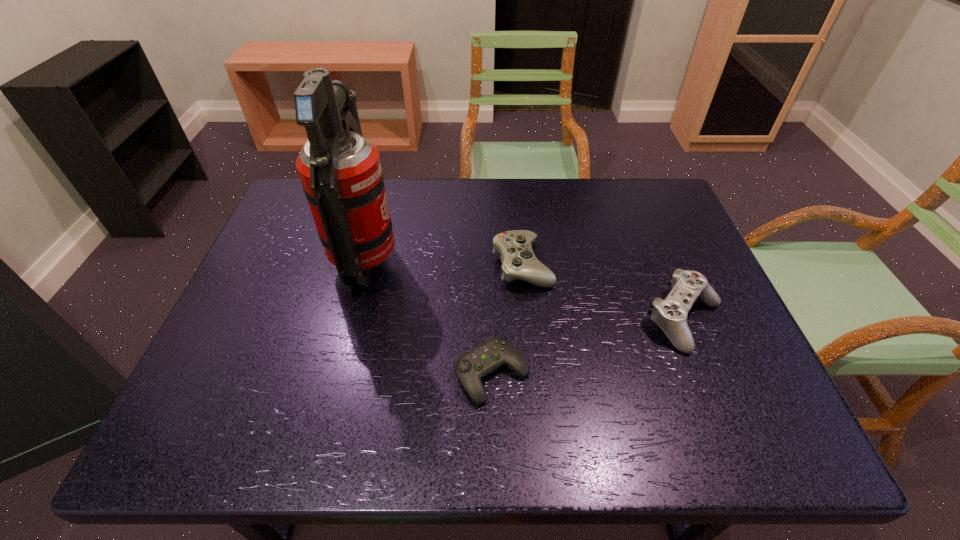
You are a GUI agent. You are given a task and a screenshot of the screen. Output one action in this format:
    pyautogui.click(x=<x>, y=<y>)
    Task: Click on the leftmost object
    
    Given the screenshot: What is the action you would take?
    pyautogui.click(x=340, y=170)

Locate an element on the screen. Image resolution: width=960 pixels, height=540 pixels. fire extinguisher is located at coordinates (340, 170).

What are the coordinates of `the rightmost control` in the screenshot? It's located at (670, 315).

Image resolution: width=960 pixels, height=540 pixels. What are the coordinates of `the shortest control` in the screenshot? It's located at (470, 367).

The height and width of the screenshot is (540, 960). I want to click on blank space located on the front label side of the tallest object, so point(500,260).

The image size is (960, 540). Find the location of `vacant space located 0.080m on the left of the rightmost object`. vacant space located 0.080m on the left of the rightmost object is located at coordinates (609, 319).

Locate an element on the screen. The image size is (960, 540). free space located on the back of the shortest object is located at coordinates (490, 303).

Where is `object located at the far edge`? The image size is (960, 540). object located at the far edge is located at coordinates (340, 170).

Where is `object situated at the right edge`? The width and height of the screenshot is (960, 540). object situated at the right edge is located at coordinates (670, 315).

Identify the location of free region at the far edge of the desktop. (417, 217).